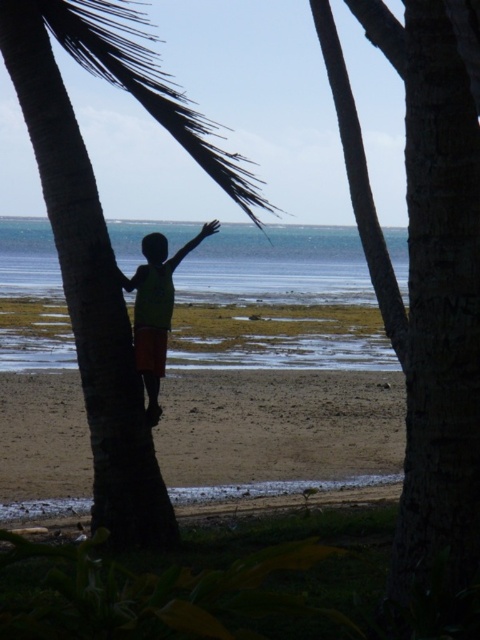
Question: Is brown rough palm tree at left behind green fabric shirt at center?

Choices:
 (A) no
 (B) yes

Answer: (A)

Question: Which of the following is the farthest from the observer?

Choices:
 (A) (171, 296)
 (B) (176, 116)

Answer: (A)

Question: Is brown rough palm tree at left further to camera compared to green fabric shirt at center?

Choices:
 (A) yes
 (B) no

Answer: (B)

Question: Which point is farther to the camera?

Choices:
 (A) (145, 268)
 (B) (110, 509)

Answer: (A)

Question: Can you confirm if brown rough palm tree at left is positioned below green fabric shirt at center?

Choices:
 (A) no
 (B) yes

Answer: (A)